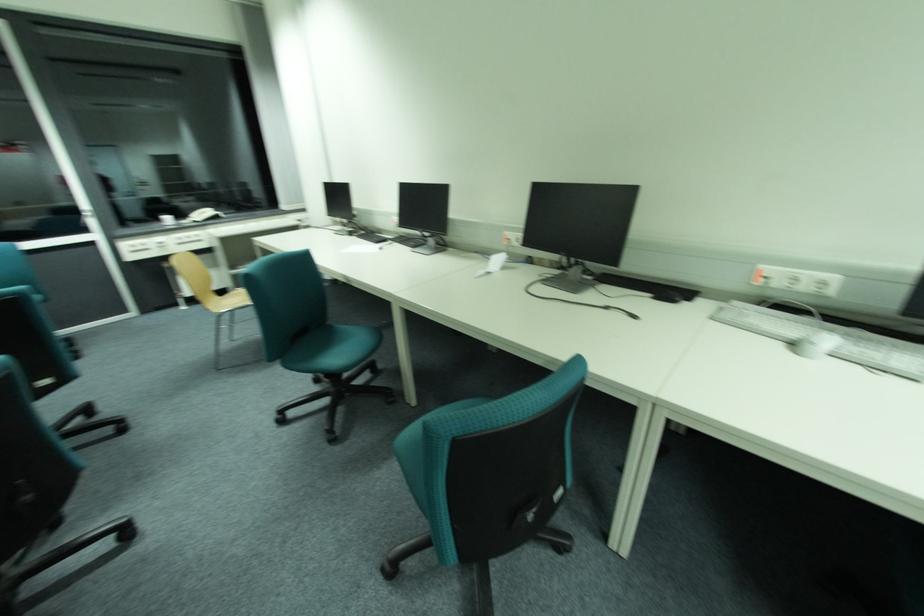
The image size is (924, 616). Identify the location of white power outlet. (796, 280).